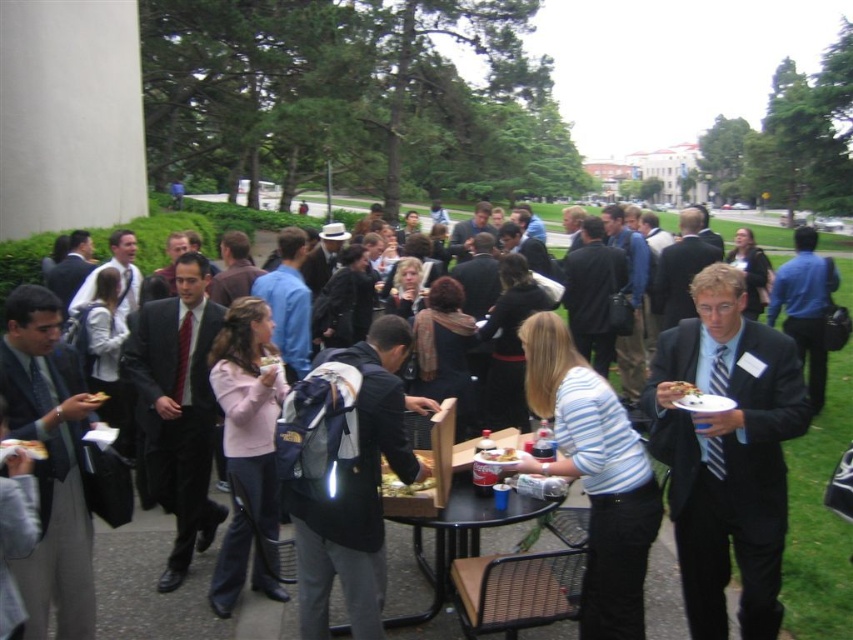
Based on the photo, you are planning to place a white paper plate at upper center on the black plastic table at center. Will the plate fit on the table?

The black plastic table at center is larger in size than white paper plate at upper center, so the plate will fit on the table.

You are organizing a photo shoot and need to position the matte black suit at right and the dark gray backpack at center in a way that maintains their relative height. Which object should be placed higher in the frame?

The matte black suit at right should be placed higher in the frame since it is much taller than the dark gray backpack at center.